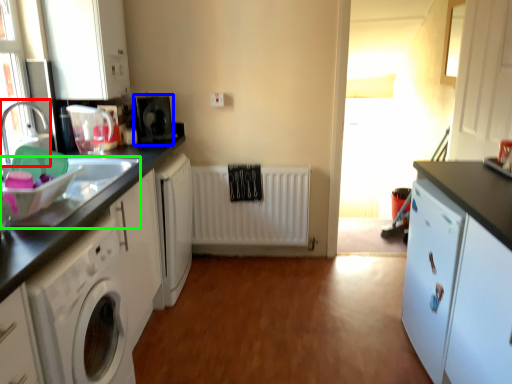
Question: Which object is the closest to the faucet (highlighted by a red box)? Choose among these: appliance (highlighted by a blue box) or sink (highlighted by a green box).

Choices:
 (A) appliance
 (B) sink

Answer: (B)